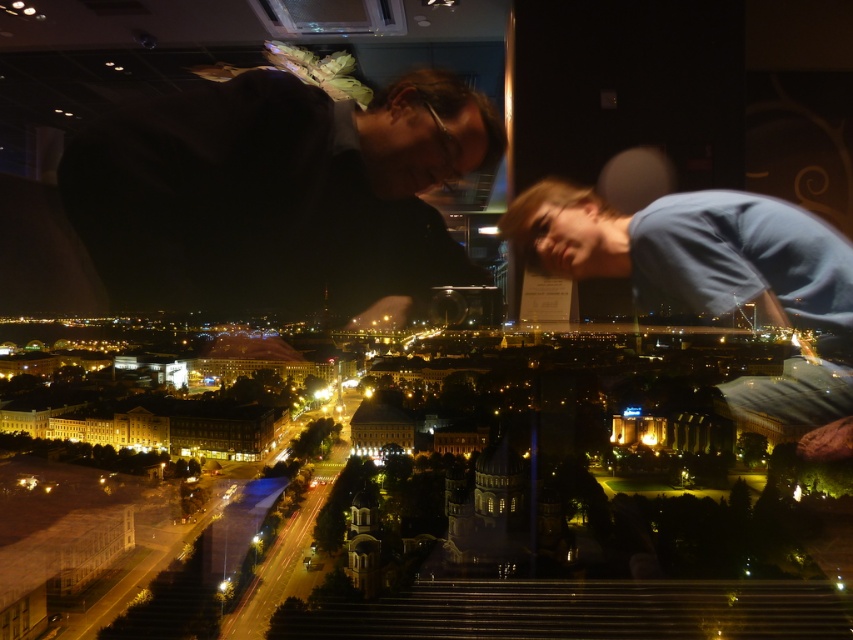
Question: Which point is closer to the camera?

Choices:
 (A) blue cotton shirt at upper right
 (B) dark matte shirt at upper left

Answer: (A)

Question: Can you confirm if dark matte shirt at upper left is positioned below blue cotton shirt at upper right?

Choices:
 (A) no
 (B) yes

Answer: (A)

Question: Does dark matte shirt at upper left have a lesser width compared to blue cotton shirt at upper right?

Choices:
 (A) yes
 (B) no

Answer: (B)

Question: Can you confirm if dark matte shirt at upper left is positioned to the left of blue cotton shirt at upper right?

Choices:
 (A) no
 (B) yes

Answer: (B)

Question: Which of the following is the closest to the observer?

Choices:
 (A) blue cotton shirt at upper right
 (B) dark matte shirt at upper left

Answer: (A)

Question: Which of the following is the farthest from the observer?

Choices:
 (A) (799, 308)
 (B) (129, 221)

Answer: (B)